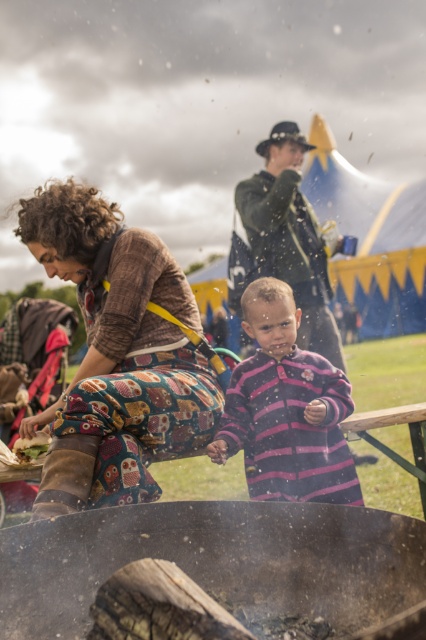
What is the object located at the coordinates point (x=224, y=564) in the image?

The object at point (x=224, y=564) is the charcoal black wood at lower center.

You are standing at the center of the image and want to place a new object at the same location as the charcoal black wood at lower center. What are the coordinates you should aim for?

The coordinates for the charcoal black wood at lower center are at point (224, 564). You should aim for those coordinates to place the new object there.

You are a photographer at the festival. You want to take a photo of the pink striped sweater at center and the grilled bread at lower left. Which object should you zoom in on to make them appear the same size in the photo?

Since the pink striped sweater at center is larger in size than the grilled bread at lower left, you should zoom in on the grilled bread at lower left to make them appear the same size in the photo.